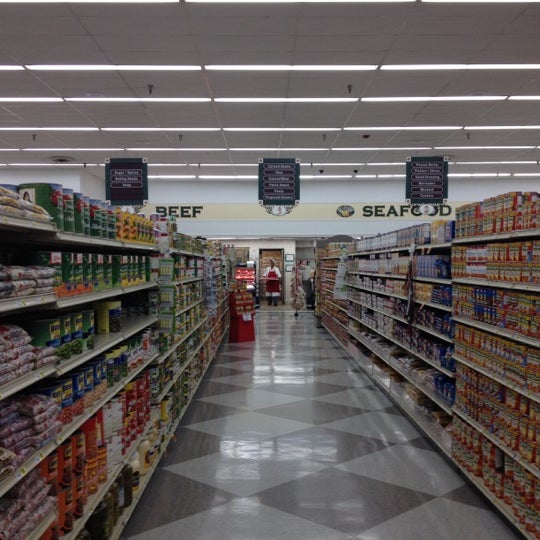
Find the location of a particular element. The image size is (540, 540). back wall is located at coordinates (307, 227).